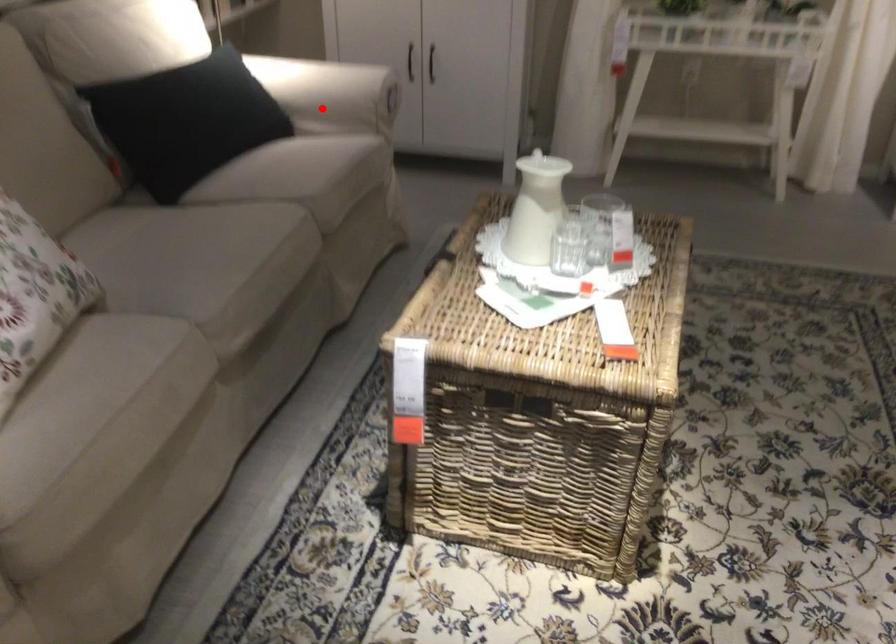
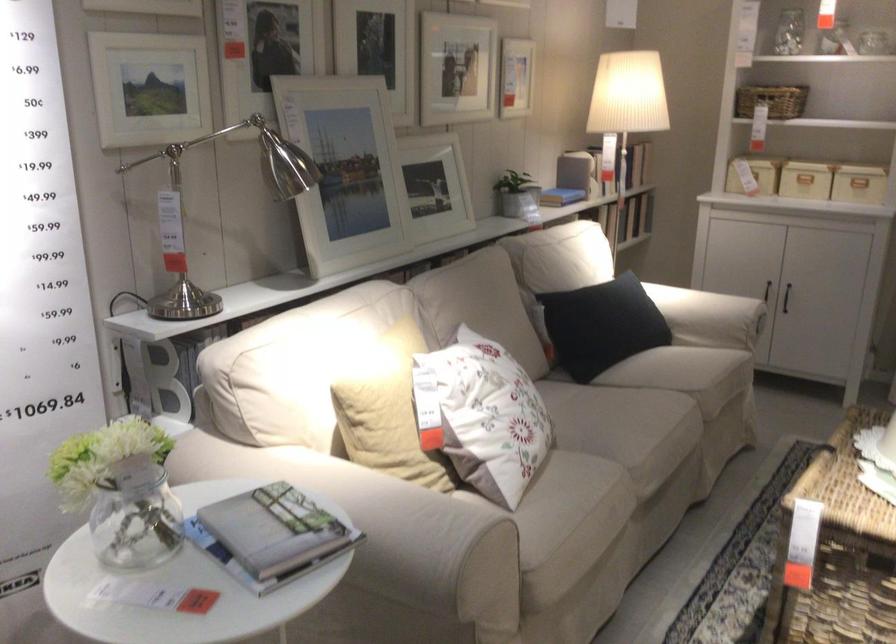
Question: I am providing you with two images of the same scene from different viewpoints. A red point is shown in image1. For the corresponding object point in image2, is it positioned nearer or farther from the camera?

Choices:
 (A) Nearer
 (B) Farther

Answer: (B)